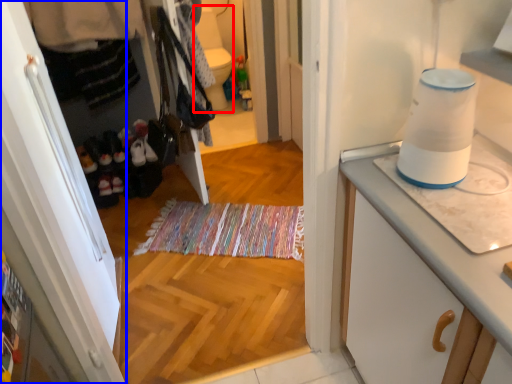
Question: Which of the following is the closest to the observer, toilet bowl (highlighted by a red box) or cabinetry (highlighted by a blue box)?

Choices:
 (A) toilet bowl
 (B) cabinetry

Answer: (B)